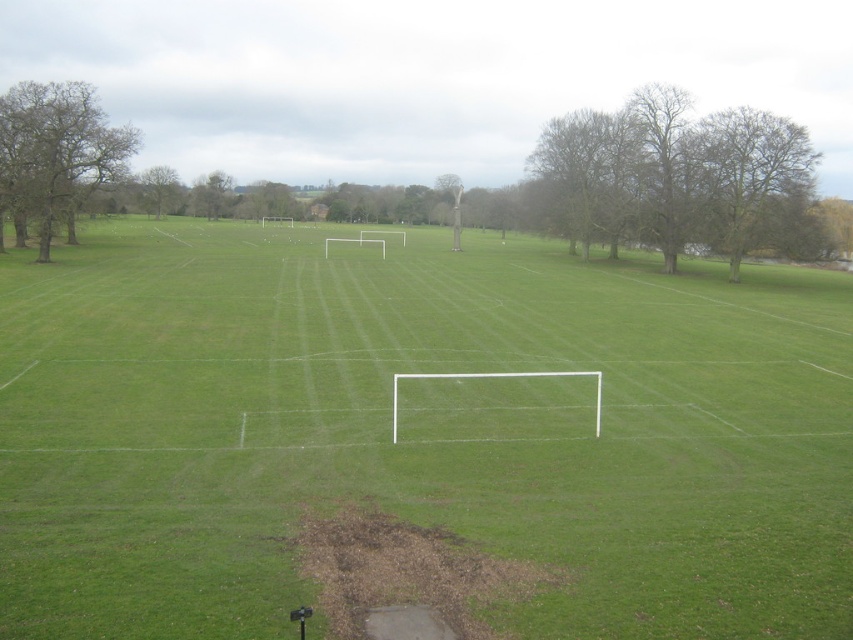
Question: Does green smooth grass at center have a lesser width compared to green leafy tree at upper left?

Choices:
 (A) yes
 (B) no

Answer: (B)

Question: Does bare branches at upper right have a lesser width compared to green leafy tree at upper left?

Choices:
 (A) no
 (B) yes

Answer: (A)

Question: Which point is closer to the camera?

Choices:
 (A) (28, 444)
 (B) (553, 188)
 (C) (35, 216)

Answer: (A)

Question: Can you confirm if green smooth grass at center is wider than bare branches at upper right?

Choices:
 (A) yes
 (B) no

Answer: (A)

Question: Which object is the closest to the green smooth grass at center?

Choices:
 (A) brown leafless tree at upper right
 (B) green leafy tree at upper left
 (C) brown leafless tree at upper left

Answer: (A)

Question: Which object is closer to the camera taking this photo?

Choices:
 (A) brown leafless tree at upper right
 (B) bare branches at upper right
 (C) green smooth grass at center

Answer: (C)